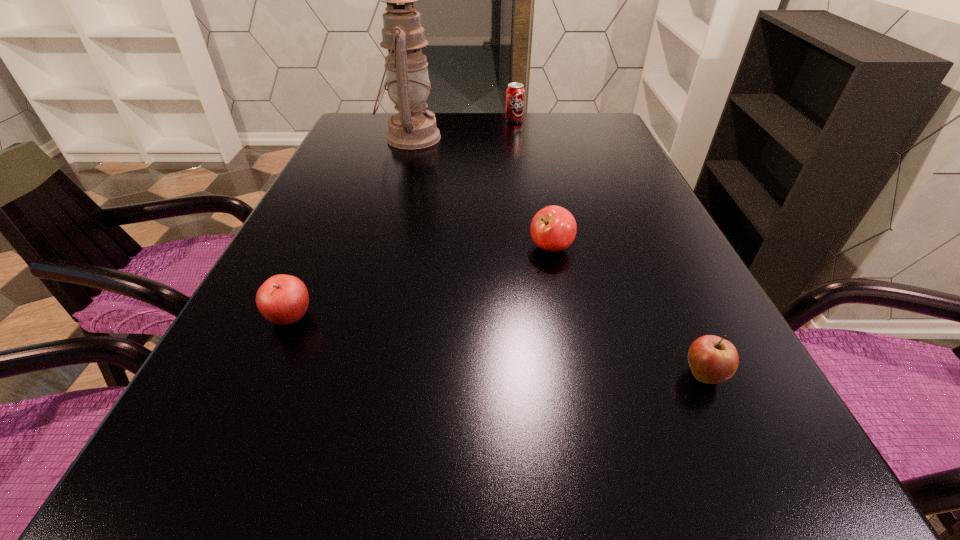
Identify the location of free space at the near edge of the desktop. The width and height of the screenshot is (960, 540). (643, 498).

Find the location of `free space at the left edge of the desktop`. free space at the left edge of the desktop is located at coordinates (233, 410).

In the image, there is a desktop. Identify the location of free space at the right edge. (622, 279).

The width and height of the screenshot is (960, 540). I want to click on blank space at the far right corner, so click(x=598, y=141).

This screenshot has width=960, height=540. I want to click on free space between the soda and the rightmost apple, so click(609, 247).

This screenshot has width=960, height=540. I want to click on free area in between the fourth shortest object and the rightmost apple, so click(x=609, y=247).

This screenshot has width=960, height=540. I want to click on free space between the nearest apple and the second nearest object, so click(497, 346).

Locate an element on the screen. This screenshot has height=540, width=960. empty location between the soda and the second apple from left to right is located at coordinates (533, 184).

This screenshot has width=960, height=540. Identify the location of free space that is in between the oil lamp and the leftmost apple. (350, 227).

The image size is (960, 540). Find the location of `vacant area that lies between the tallest object and the nearest apple`. vacant area that lies between the tallest object and the nearest apple is located at coordinates (557, 256).